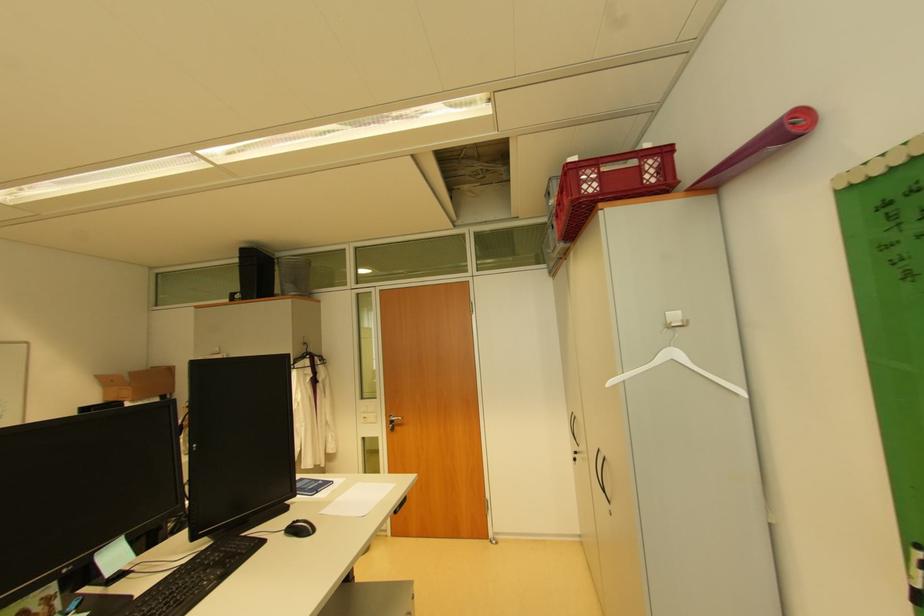
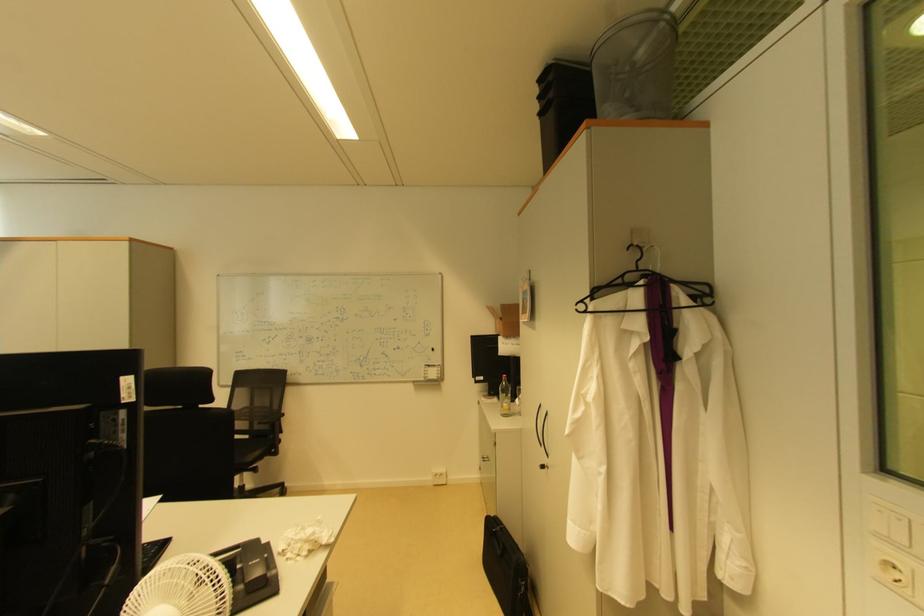
Where in the second image is the point corresponding to (x=372, y=414) from the first image?

(894, 541)